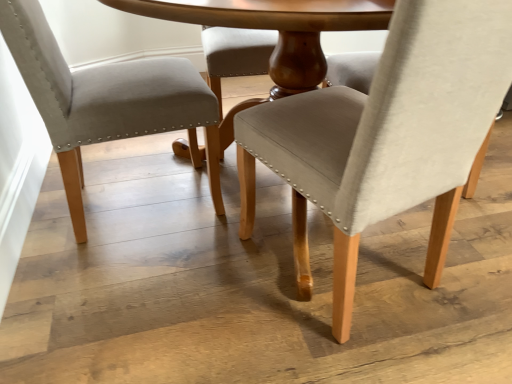
You are a GUI agent. You are given a task and a screenshot of the screen. Output one action in this format:
    pyautogui.click(x=<x>, y=<y>)
    Task: Click on the free space that is in between matte beige fabric chair at center, which is counted as the 2th chair, starting from the left, and beige fabric chair at left, which is the 2th chair from right to left
    The width and height of the screenshot is (512, 384).
    Given the screenshot: What is the action you would take?
    pyautogui.click(x=211, y=249)